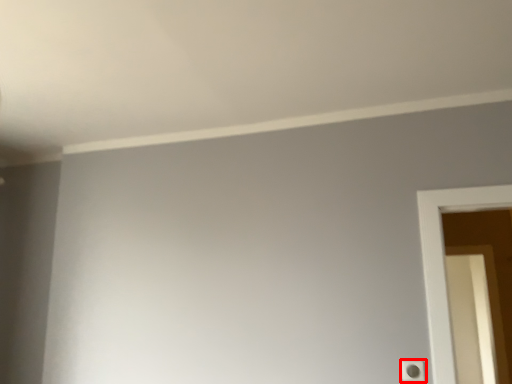
Question: Where is light switch (annotated by the red box) located in relation to screen door in the image?

Choices:
 (A) left
 (B) right

Answer: (A)